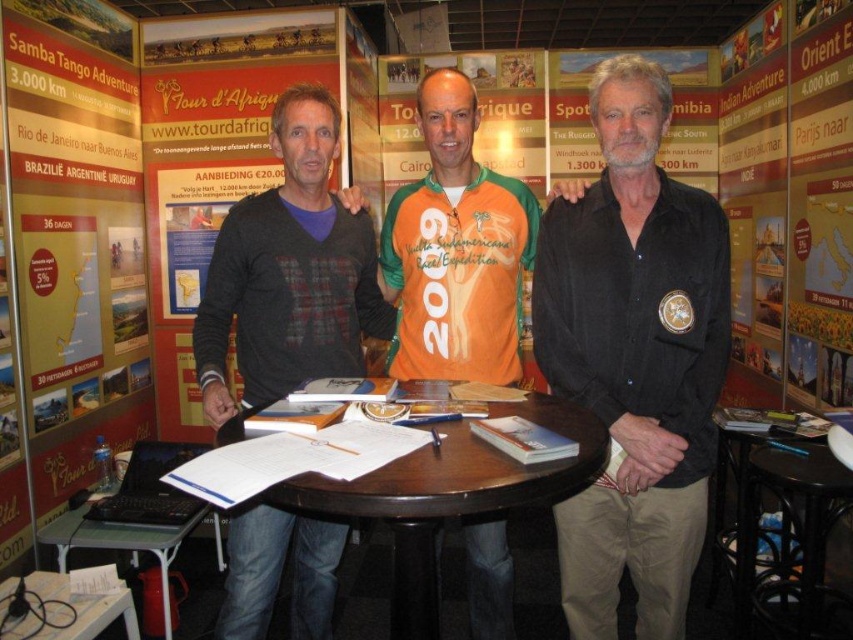
Question: From the image, what is the correct spatial relationship of black matte shirt at center in relation to orange jersey at center?

Choices:
 (A) left
 (B) right

Answer: (B)

Question: Estimate the real-world distances between objects in this image. Which object is farther from the orange jersey at center?

Choices:
 (A) metallic silver laptop at lower left
 (B) dark brown wood round table at center

Answer: (A)

Question: Can you confirm if orange jersey at center is thinner than dark brown wood round table at center?

Choices:
 (A) yes
 (B) no

Answer: (A)

Question: Estimate the real-world distances between objects in this image. Which object is farther from the black plastic stool at lower right?

Choices:
 (A) metallic silver laptop at lower left
 (B) dark brown wood round table at center
 (C) orange jersey at center

Answer: (A)

Question: Which point appears closest to the camera in this image?

Choices:
 (A) [819, 548]
 (B) [479, 234]
 (C) [605, 337]
 (D) [496, 410]

Answer: (D)

Question: Does black matte shirt at center appear over metallic silver laptop at lower left?

Choices:
 (A) yes
 (B) no

Answer: (A)